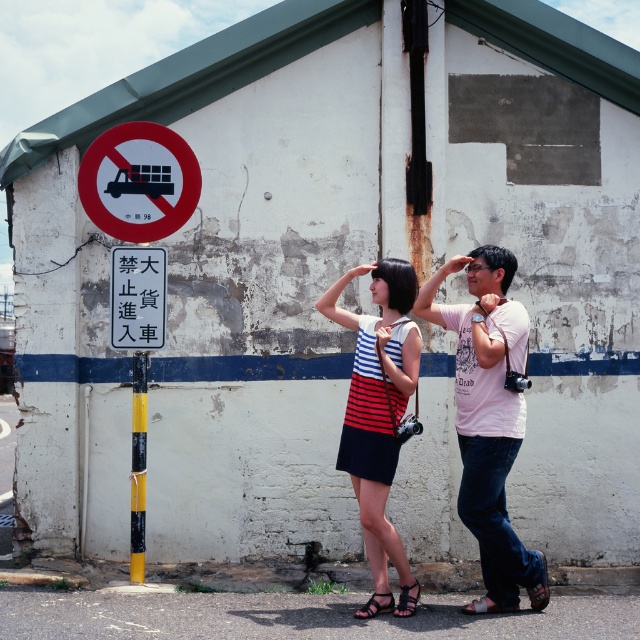
Question: Which object is the farthest from the yellow painted pole at lower center?

Choices:
 (A) striped cotton dress at center
 (B) white plastic sign at center
 (C) white cotton t-shirt at center

Answer: (C)

Question: Considering the real-world distances, which object is closest to the white plastic sign at center?

Choices:
 (A) striped cotton dress at center
 (B) red circle sign at upper left
 (C) white cotton t-shirt at center

Answer: (B)

Question: Does red circle sign at upper left appear on the right side of white plastic sign at center?

Choices:
 (A) no
 (B) yes

Answer: (B)

Question: Considering the real-world distances, which object is closest to the white plastic sign at center?

Choices:
 (A) striped cotton dress at center
 (B) white cotton t-shirt at center
 (C) yellow painted pole at lower center

Answer: (C)

Question: Does striped cotton dress at center come behind red circle sign at upper left?

Choices:
 (A) no
 (B) yes

Answer: (A)

Question: Is white cotton t-shirt at center thinner than white plastic sign at center?

Choices:
 (A) yes
 (B) no

Answer: (B)